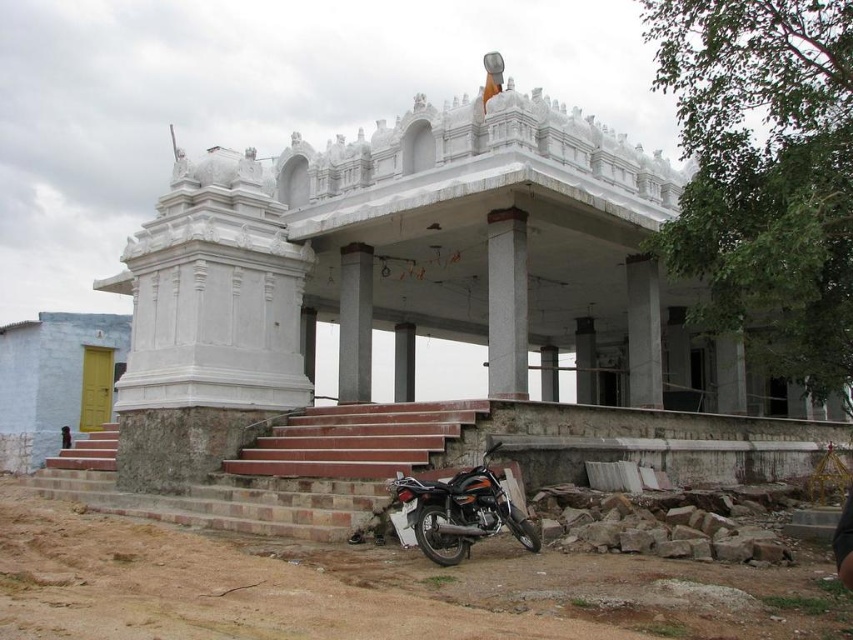
Is point (447, 520) closer to camera compared to point (349, 253)?

Yes, it is in front of point (349, 253).

Between point (434, 538) and point (352, 275), which one is positioned in front?

Point (434, 538)

Find the location of a particular element. The width and height of the screenshot is (853, 640). shiny metallic motorbike at lower center is located at coordinates coord(457,513).

Who is higher up, brick stairs at lower center or shiny metallic motorbike at lower center?

Positioned higher is shiny metallic motorbike at lower center.

Does brick stairs at lower center appear over shiny metallic motorbike at lower center?

Actually, brick stairs at lower center is below shiny metallic motorbike at lower center.

Find the location of `brick stairs at lower center`. brick stairs at lower center is located at coordinates (280, 468).

Can you confirm if smooth concrete column at center is positioned above smooth concrete pillar at center?

No.

Find the location of a particular element. The height and width of the screenshot is (640, 853). smooth concrete column at center is located at coordinates (508, 304).